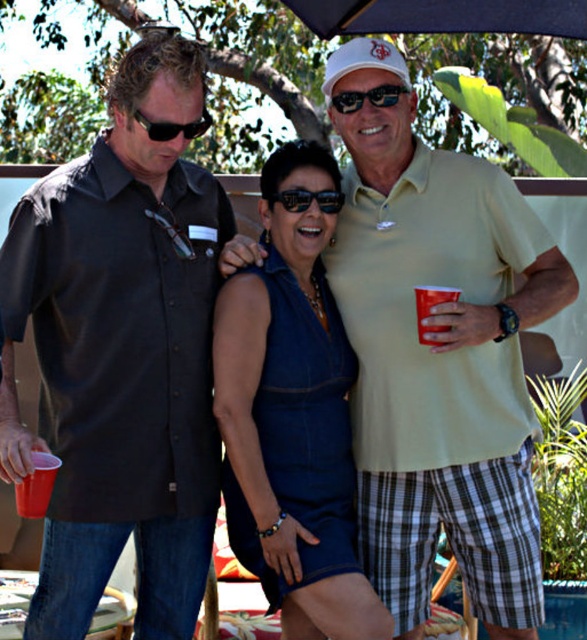
You are standing at the center of the image and want to locate the denim dress at center. Which direction should you look to find it?

The denim dress at center is already at your current position since you are standing at the center of the image.

You are taking a photo of the scene and want to focus on both point (295,256) and point (48,464). Which point should you adjust your focus to first to ensure both are in clear view?

You should focus on point (295,256) first because it is closer to the camera than point (48,464). By focusing on the closer point, the farther point may also come into focus depending on the depth of field.

You are at an outdoor event and see the red plastic cup at center and the black plastic sunglasses at upper left. Which object is closer to you?

The red plastic cup at center is closer to you because it is in front of the black plastic sunglasses at upper left.